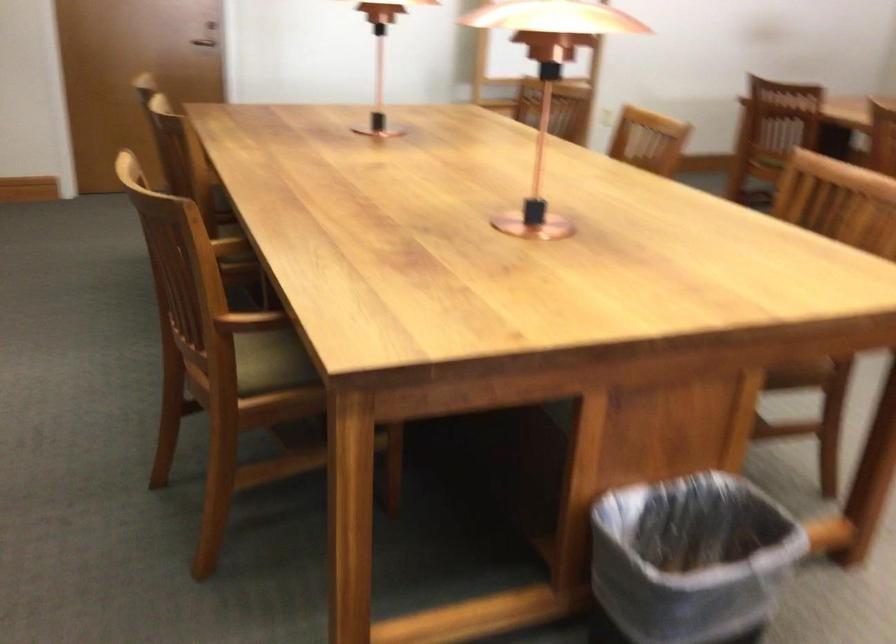
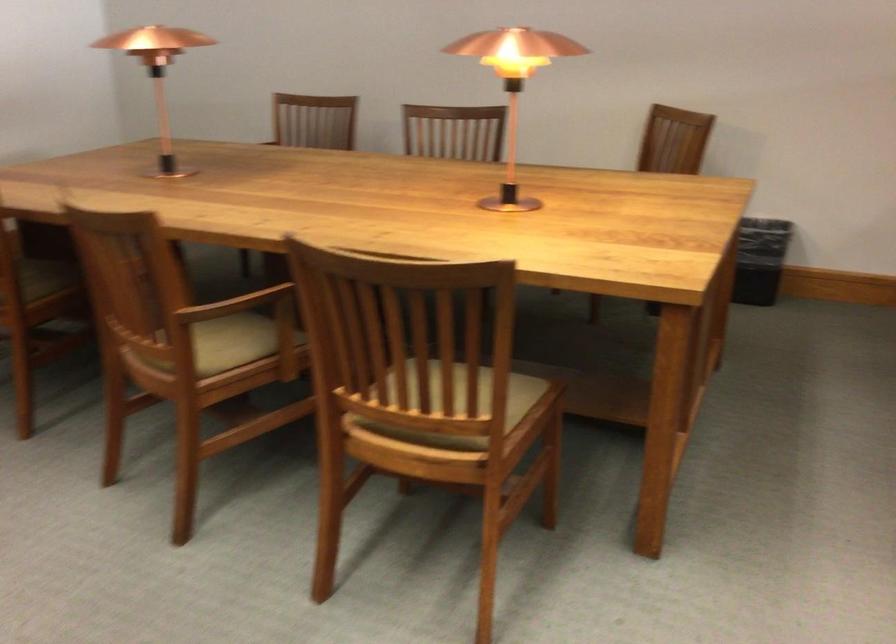
Locate, in the second image, the point that corresponds to (821,135) in the first image.

(44, 279)